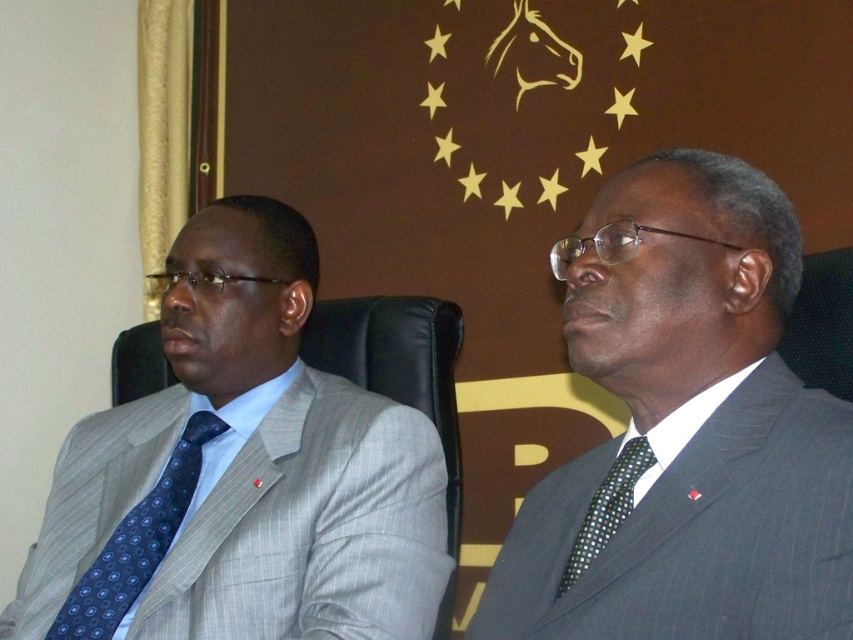
You are a tailor observing two men in an office setting. You need to determine which item is taller between the gray pinstripe suit at left and the blue dotted tie at left. Which one is taller?

The gray pinstripe suit at left is taller than the blue dotted tie at left.

You are a tailor observing two men in a formal setting. The men are wearing a gray pinstripe suit at left and a blue dotted tie at left. Which item of clothing is wider?

The gray pinstripe suit at left is wider than the blue dotted tie at left according to the description provided.

You are an assistant who needs to identify the exact position of the dark gray pinstripe suit at right in the image. What are its coordinates?

The dark gray pinstripe suit at right is located at point (x=685, y=429).